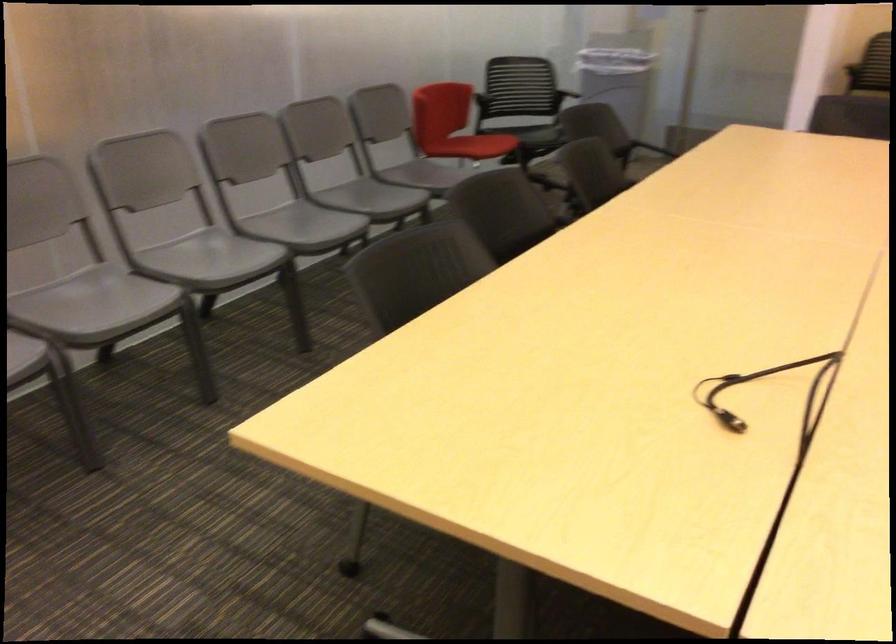
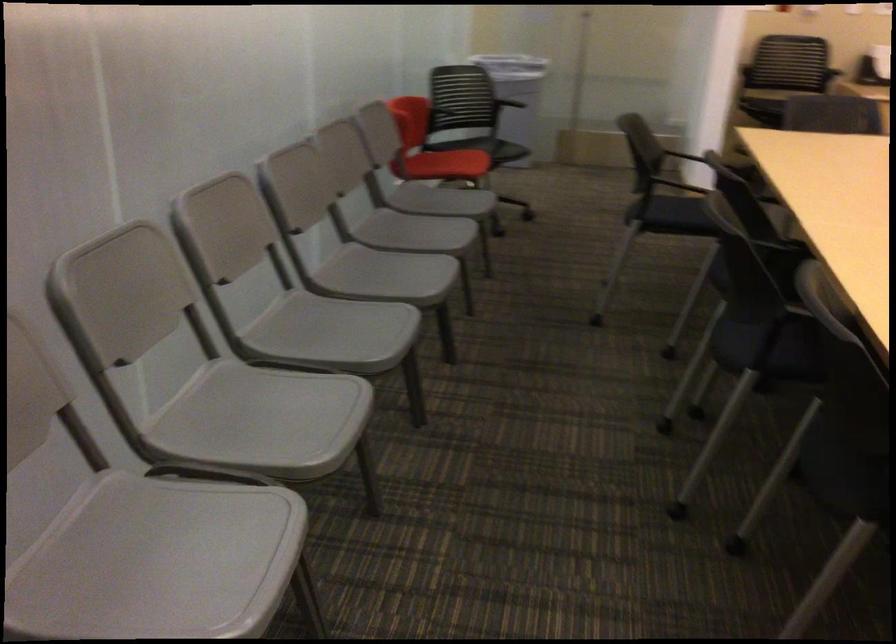
Where in the second image is the point corresponding to [474,146] from the first image?

(446, 164)